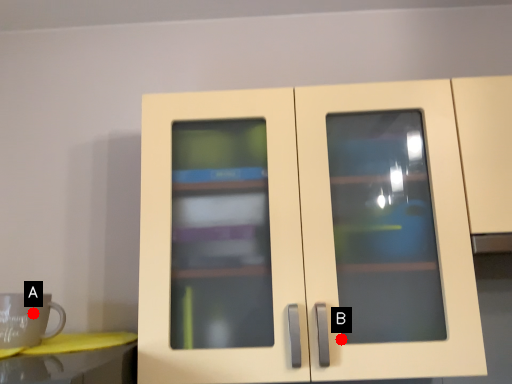
Question: Two points are circled on the image, labeled by A and B beside each circle. Which point appears farthest from the camera in this image?

Choices:
 (A) A is further
 (B) B is further

Answer: (A)